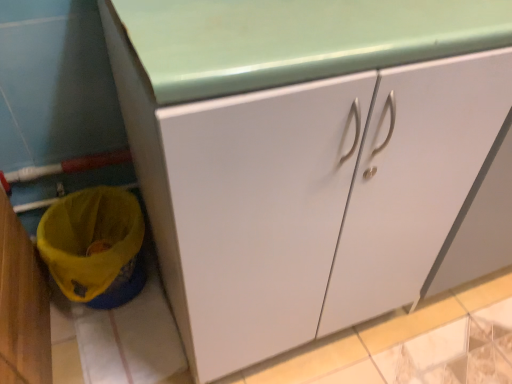
The image size is (512, 384). What do you see at coordinates (92, 245) in the screenshot? I see `yellow fabric laundry basket at lower left` at bounding box center [92, 245].

In order to click on yellow fabric laundry basket at lower left in this screenshot , I will do tap(92, 245).

Identify the location of yellow fabric laundry basket at lower left. (92, 245).